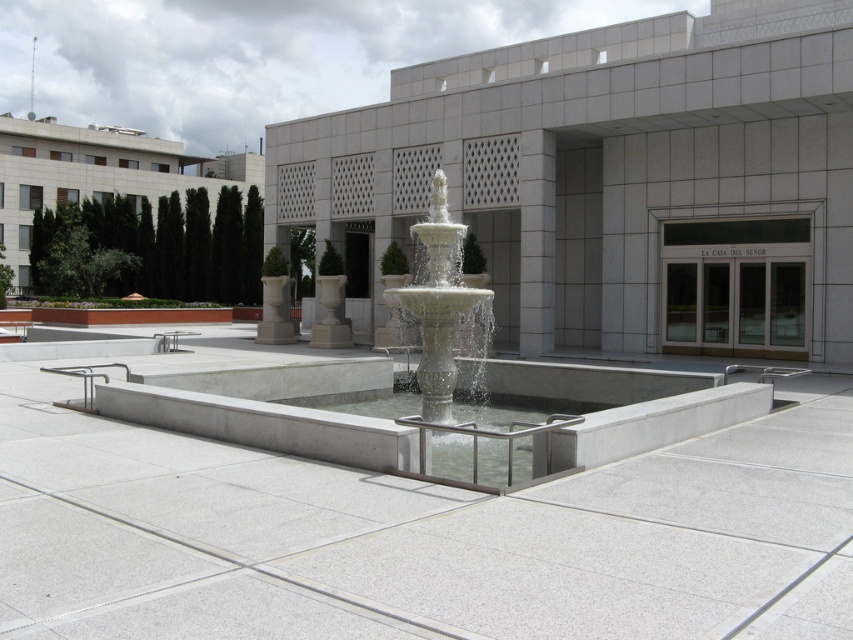
Does white concrete fountain at center appear on the left side of white marble fountain at center?

Yes, white concrete fountain at center is to the left of white marble fountain at center.

Measure the distance between point (706, 448) and camera.

A distance of 27.72 feet exists between point (706, 448) and camera.

Locate an element on the screen. white concrete fountain at center is located at coordinates (419, 536).

Does white concrete fountain at center appear on the left side of white smooth pillar at center?

Yes, white concrete fountain at center is to the left of white smooth pillar at center.

Is white concrete fountain at center behind white smooth pillar at center?

No.

Measure the distance between point (12,480) and camera.

Point (12,480) and camera are 22.33 feet apart from each other.

Locate an element on the screen. This screenshot has height=640, width=853. white concrete fountain at center is located at coordinates (419, 536).

Is white marble fountain at center thinner than white smooth pillar at center?

In fact, white marble fountain at center might be wider than white smooth pillar at center.

Between white marble fountain at center and white smooth pillar at center, which one appears on the left side from the viewer's perspective?

white marble fountain at center

Is point (438, 294) positioned behind point (527, 131)?

That is False.

Identify the location of white marble fountain at center. The height and width of the screenshot is (640, 853). (437, 305).